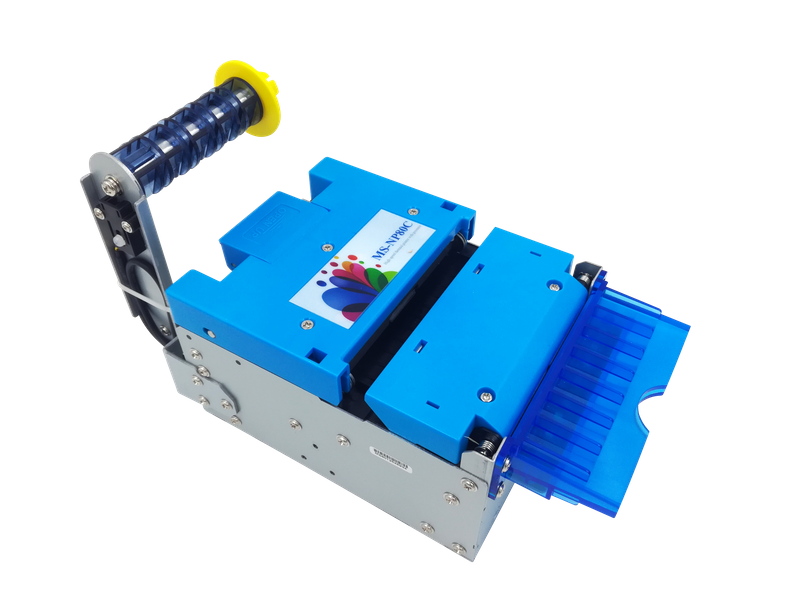
In order to click on box in this screenshot , I will do `click(213, 354)`.